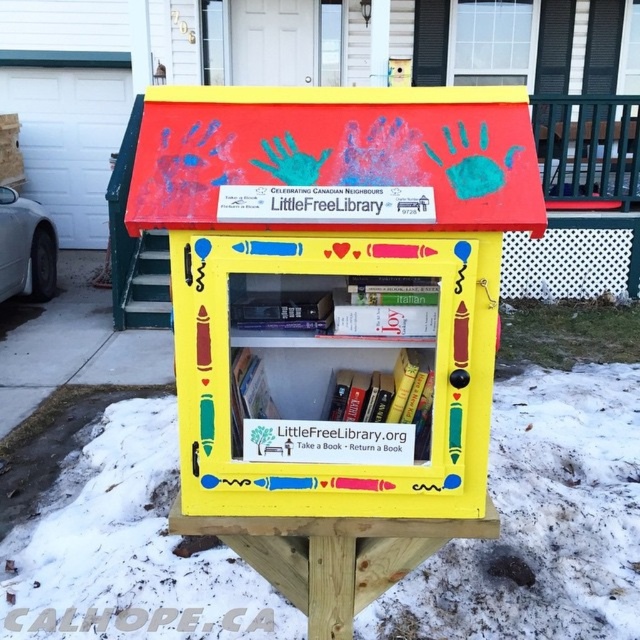
You are a child who wants to reach the hardcover book at center in the Little Free Library but there is white powdery snow at lower center blocking your path. Can you step over the snow to get to the book?

The distance between the white powdery snow at lower center and the hardcover book at center is 1.30 meters. Since the snow is only at the lower center, you can step over it to reach the hardcover book at center as the distance is manageable for a child to jump over.

You are standing in front of the Little Free Library and want to place a new book on the shelf. You notice two points marked on the library structure. Which point is closer to you, point (104, 513) or point (243, 438)?

Point (104, 513) is further to the viewer than point (243, 438), so point (243, 438) is closer to you.

From the picture: You are standing in front of the Little Free Library and notice a point marked at coordinates [541,522]. What does this point represent?

The point at coordinates [541,522] represents the white powdery snow at lower center.